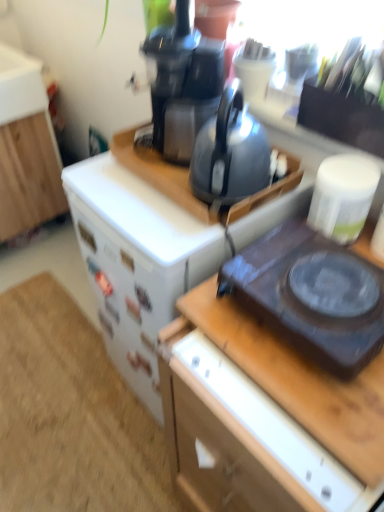
Question: Is black plastic gas stove at right surrounded by wooden desk at center?

Choices:
 (A) yes
 (B) no

Answer: (B)

Question: Considering the relative sizes of wooden desk at center and black plastic gas stove at right in the image provided, is wooden desk at center taller than black plastic gas stove at right?

Choices:
 (A) no
 (B) yes

Answer: (B)

Question: Does wooden desk at center appear on the left side of black plastic gas stove at right?

Choices:
 (A) no
 (B) yes

Answer: (A)

Question: Does wooden desk at center have a greater width compared to black plastic gas stove at right?

Choices:
 (A) yes
 (B) no

Answer: (A)

Question: Considering the relative sizes of wooden desk at center and black plastic gas stove at right in the image provided, is wooden desk at center bigger than black plastic gas stove at right?

Choices:
 (A) no
 (B) yes

Answer: (B)

Question: Would you consider wooden desk at center to be distant from black plastic gas stove at right?

Choices:
 (A) yes
 (B) no

Answer: (B)

Question: Can you confirm if black plastic gas stove at right is bigger than white wood cabinet at left?

Choices:
 (A) yes
 (B) no

Answer: (B)

Question: Does black plastic gas stove at right contain white wood cabinet at left?

Choices:
 (A) no
 (B) yes

Answer: (A)

Question: Is there a large distance between black plastic gas stove at right and white wood cabinet at left?

Choices:
 (A) no
 (B) yes

Answer: (B)

Question: Is black plastic gas stove at right smaller than white wood cabinet at left?

Choices:
 (A) no
 (B) yes

Answer: (B)

Question: Considering the relative positions of black plastic gas stove at right and white wood cabinet at left in the image provided, is black plastic gas stove at right to the left of white wood cabinet at left from the viewer's perspective?

Choices:
 (A) no
 (B) yes

Answer: (A)

Question: Is black plastic gas stove at right completely or partially outside of white wood cabinet at left?

Choices:
 (A) no
 (B) yes

Answer: (B)

Question: Is black plastic gas stove at right at the left side of matte black kettle at center?

Choices:
 (A) no
 (B) yes

Answer: (A)